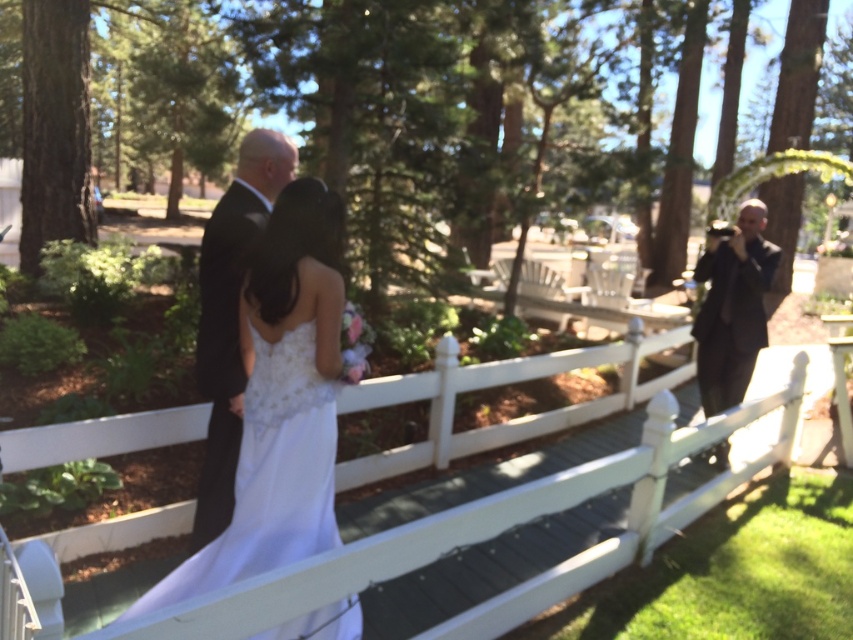
You are a photographer at the wedding. You need to adjust the lighting so that both the white satin dress at center and the black satin suit at center are equally visible. Considering their sizes, which one might require more light to ensure it doesn

The white satin dress at center occupies less space than the black satin suit at center. Since the white dress is smaller, it might need more light to ensure it stands out against the darker suit and the background.

You are a photographer at the wedding. You need to adjust the camera focus so that both the black satin suit at center and the black suit at right are in focus. Which subject should you focus on to ensure both are sharp?

Focus on the black satin suit at center because it is much taller than the black suit at right, so focusing on the taller subject will help both be in focus.

Looking at this image, you are a photographer positioned at the back of the scene. You want to take a photo of both the black satin suit at center and the black suit at right. Which person should you adjust your camera focus on first to ensure both are in the frame?

You should focus on the black satin suit at center first since it is closer to the photographer than the black suit at right, ensuring both are in the frame.